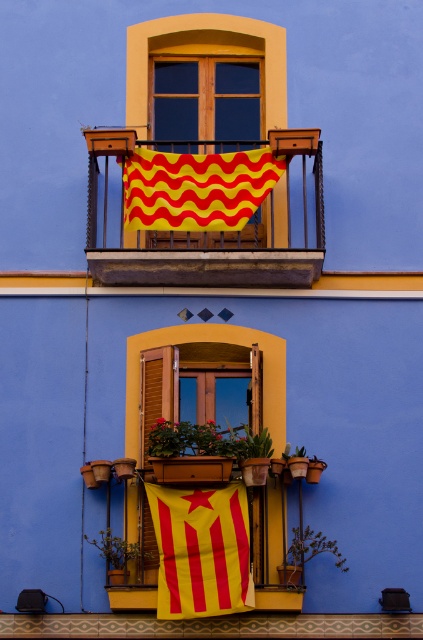
Question: Among these objects, which one is nearest to the camera?

Choices:
 (A) yellow/red striped fabric at upper center
 (B) wooden at left

Answer: (B)

Question: Does yellowmaterial/textureflag at lower center come in front of wooden at left?

Choices:
 (A) yes
 (B) no

Answer: (A)

Question: From the image, what is the correct spatial relationship of yellow fabric at upper center in relation to matte wood window at upper center?

Choices:
 (A) above
 (B) below

Answer: (B)

Question: Is yellowmaterial/textureflag at lower center to the left of matte wood window at upper center from the viewer's perspective?

Choices:
 (A) yes
 (B) no

Answer: (B)

Question: Which point appears farthest from the camera in this image?

Choices:
 (A) (211, 481)
 (B) (275, 177)

Answer: (B)

Question: Which point appears closest to the camera in this image?

Choices:
 (A) (154, 470)
 (B) (189, 100)
 (C) (216, 218)

Answer: (A)